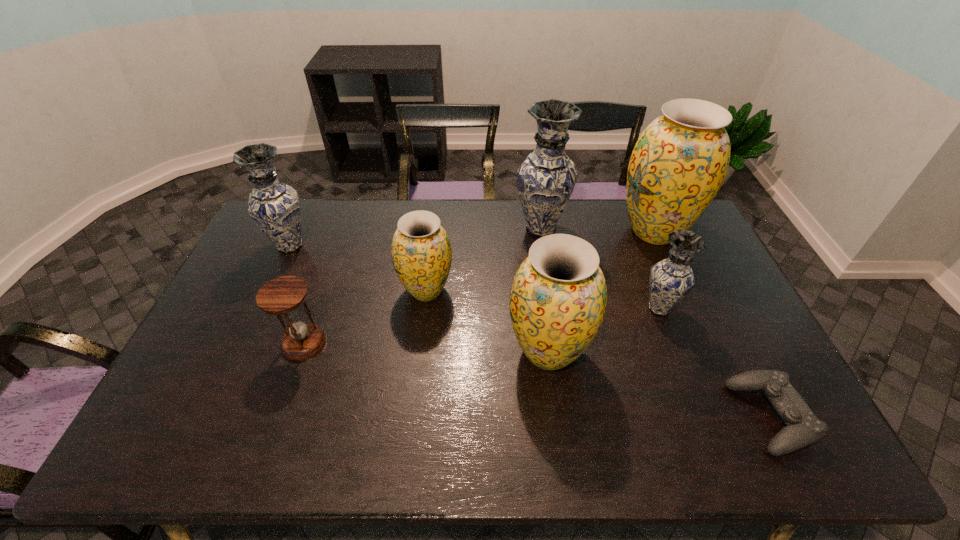
I want to click on the nearest blue vase, so click(671, 279).

Find the location of a particular element. This screenshot has height=540, width=960. the seventh tallest object is located at coordinates (282, 296).

Where is `hourglass`? hourglass is located at coordinates (282, 296).

Where is `gray control`? This screenshot has width=960, height=540. gray control is located at coordinates (803, 428).

Where is `the shortest object`? the shortest object is located at coordinates tap(803, 428).

The image size is (960, 540). What are the coordinates of `free space located 0.300m on the left of the second blue vase from left to right` in the screenshot? It's located at (431, 228).

You are a GUI agent. You are given a task and a screenshot of the screen. Output one action in this format:
    pyautogui.click(x=<x>, y=<y>)
    Task: Click on the vacant space located 0.070m on the left of the farthest yellow vase
    
    Given the screenshot: What is the action you would take?
    pyautogui.click(x=595, y=231)

Find the location of a particular element. free space located on the front of the second smallest blue vase is located at coordinates (275, 280).

The width and height of the screenshot is (960, 540). I want to click on free space located 0.270m on the back of the second smallest yellow vase, so click(536, 258).

Find the location of a particular element. free space located 0.150m on the front of the leftmost yellow vase is located at coordinates (419, 353).